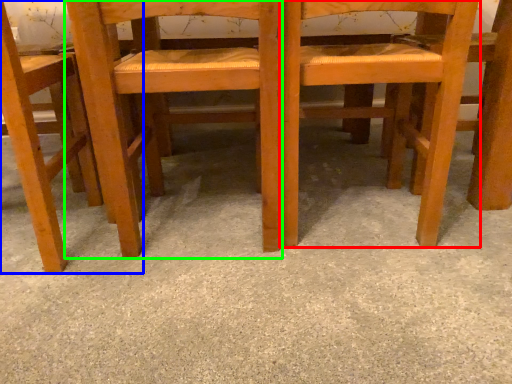
Question: Which is farther away from chair (highlighted by a red box)? chair (highlighted by a blue box) or chair (highlighted by a green box)?

Choices:
 (A) chair
 (B) chair

Answer: (A)